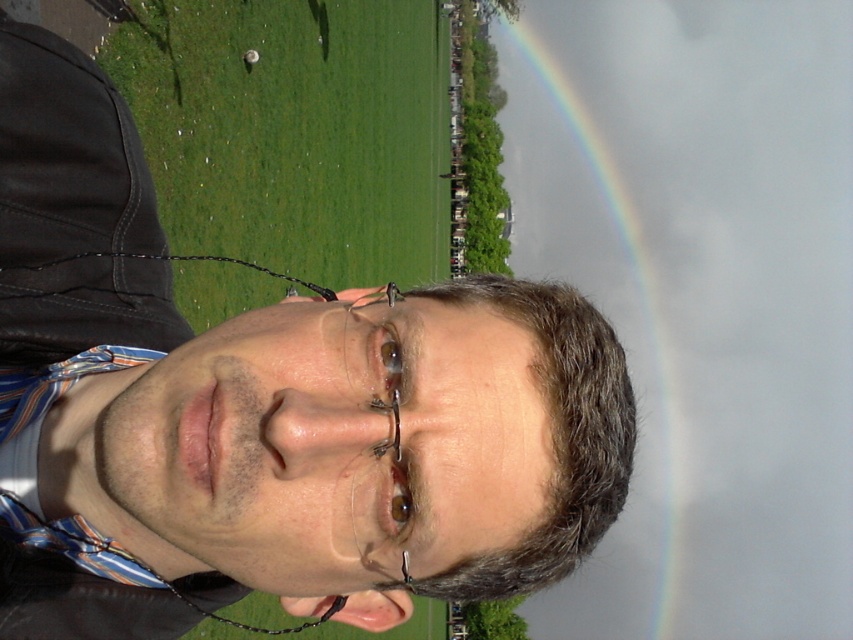
Question: Which of the following is the closest to the observer?

Choices:
 (A) rainbow at upper right
 (B) matte black jacket at center

Answer: (B)

Question: Which object appears farthest from the camera in this image?

Choices:
 (A) rainbow at upper right
 (B) matte black jacket at center

Answer: (A)

Question: Which object is farther from the camera taking this photo?

Choices:
 (A) matte black jacket at center
 (B) rainbow at upper right

Answer: (B)

Question: Can you confirm if matte black jacket at center is positioned to the right of rainbow at upper right?

Choices:
 (A) no
 (B) yes

Answer: (A)

Question: Is matte black jacket at center positioned behind rainbow at upper right?

Choices:
 (A) yes
 (B) no

Answer: (B)

Question: Can you confirm if matte black jacket at center is positioned below rainbow at upper right?

Choices:
 (A) no
 (B) yes

Answer: (A)